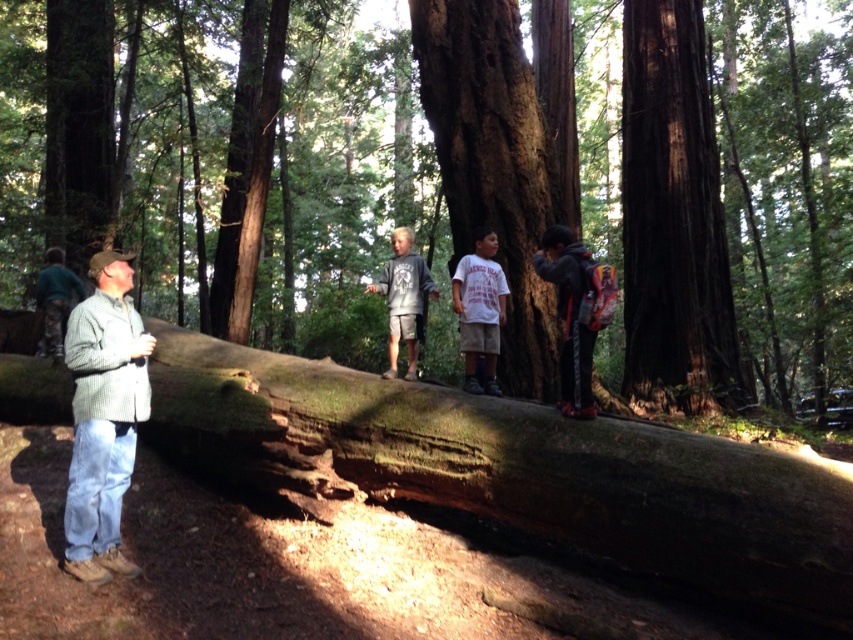
Does smooth brown log at center have a lesser height compared to white cotton shirt at center?

In fact, smooth brown log at center may be taller than white cotton shirt at center.

Which is more to the left, smooth brown log at center or white cotton shirt at center?

white cotton shirt at center

The height and width of the screenshot is (640, 853). What do you see at coordinates (786, 188) in the screenshot?
I see `smooth brown log at center` at bounding box center [786, 188].

Find the location of a particular element. This screenshot has height=640, width=853. smooth brown log at center is located at coordinates 786,188.

Does point (575, 253) lie behind point (399, 243)?

That is False.

Does point (560, 237) lie in front of point (399, 282)?

Yes, it is in front of point (399, 282).

Where is `dark gray hoodie at center`? The height and width of the screenshot is (640, 853). dark gray hoodie at center is located at coordinates (570, 316).

Which is in front, point (340, 115) or point (648, 234)?

Point (648, 234) is in front.

Is smooth brown log at center shorter than dark brown wood at center?

In fact, smooth brown log at center may be taller than dark brown wood at center.

Who is more distant from viewer, (276, 221) or (692, 344)?

The point (276, 221) is behind.

Where is `smooth brown log at center`? This screenshot has height=640, width=853. smooth brown log at center is located at coordinates 786,188.